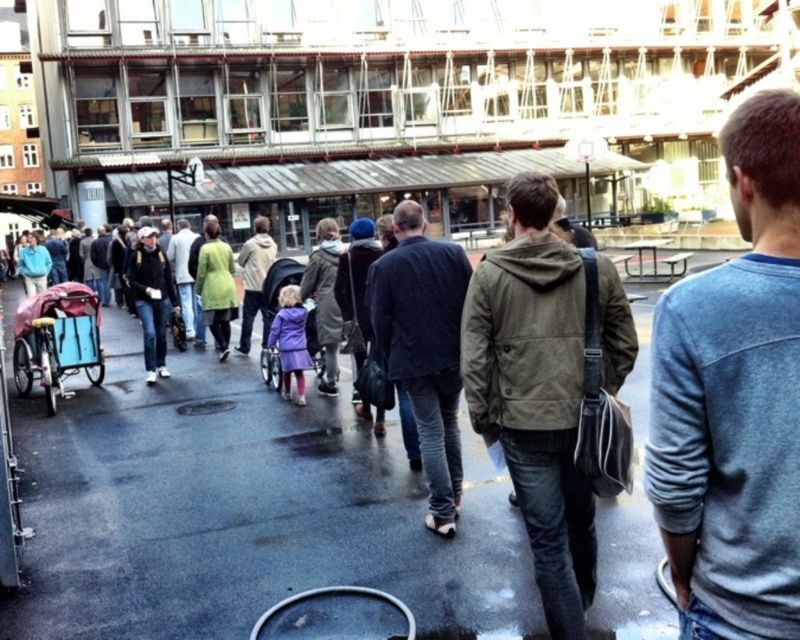
Describe the element at coordinates (424, 348) in the screenshot. I see `dark blue corduroy jacket at center` at that location.

Can you confirm if dark blue corduroy jacket at center is thinner than blue fabric baby carriage at left?

In fact, dark blue corduroy jacket at center might be wider than blue fabric baby carriage at left.

Is point (456, 422) in front of point (34, 355)?

Yes, point (456, 422) is in front of point (34, 355).

Locate an element on the screen. The image size is (800, 640). dark blue corduroy jacket at center is located at coordinates (424, 348).

Is smooth asphalt pavement at center to the left of blue cotton sweater at upper right from the viewer's perspective?

Indeed, smooth asphalt pavement at center is positioned on the left side of blue cotton sweater at upper right.

Can you confirm if smooth asphalt pavement at center is bigger than blue cotton sweater at upper right?

Yes, smooth asphalt pavement at center is bigger than blue cotton sweater at upper right.

You are a GUI agent. You are given a task and a screenshot of the screen. Output one action in this format:
    pyautogui.click(x=<x>, y=<y>)
    Task: Click on the smooth asphalt pavement at center
    The image size is (800, 640).
    Given the screenshot: What is the action you would take?
    pyautogui.click(x=241, y=512)

Can you confirm if blue cotton sweater at upper right is positioned to the left of blue fabric baby carriage at left?

No, blue cotton sweater at upper right is not to the left of blue fabric baby carriage at left.

Is the position of blue cotton sweater at upper right less distant than that of blue fabric baby carriage at left?

Yes, it is.

In order to click on blue cotton sweater at upper right in this screenshot , I will do `click(734, 400)`.